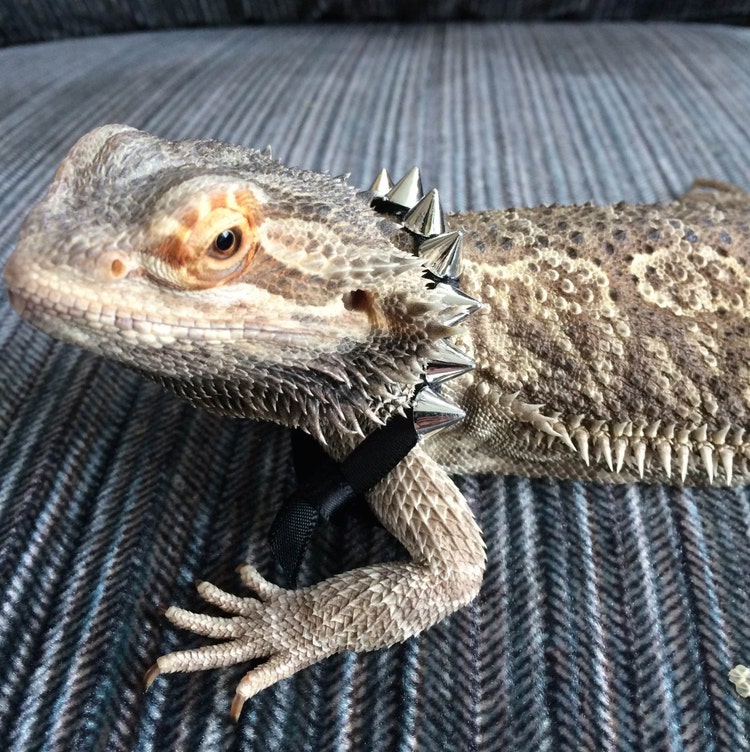
Find the location of `couch`. couch is located at coordinates (430, 129).